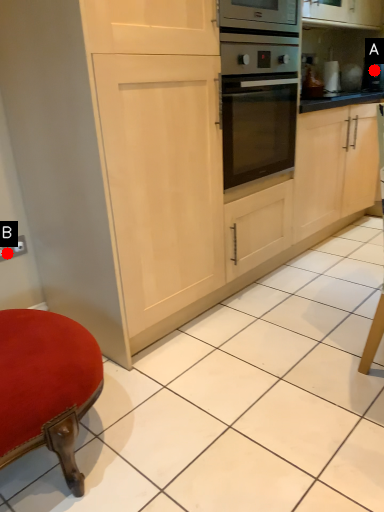
Question: Two points are circled on the image, labeled by A and B beside each circle. Which point is closer to the camera?

Choices:
 (A) A is closer
 (B) B is closer

Answer: (B)